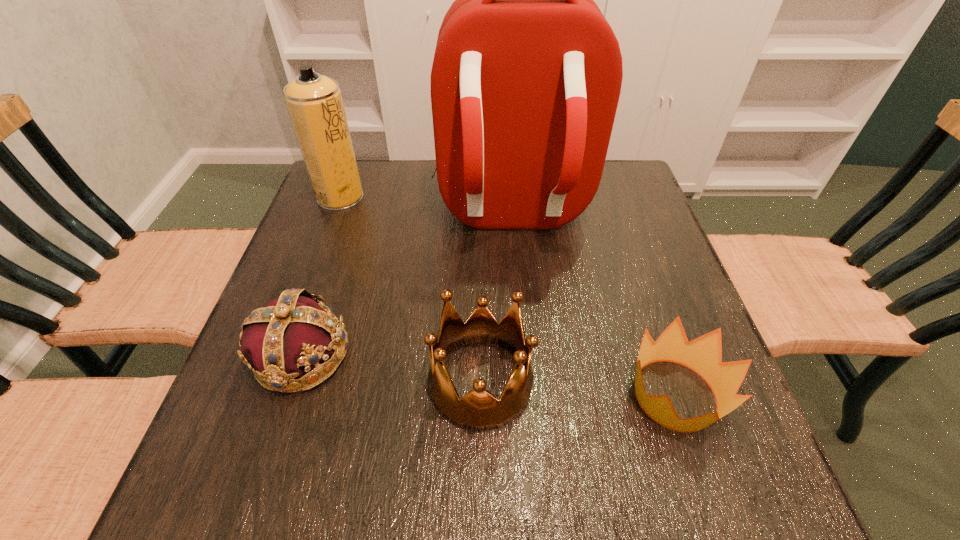
This screenshot has height=540, width=960. In order to click on vacant region located 0.060m on the left of the second crown from right to left in this screenshot , I will do `click(396, 382)`.

Find the location of a particular element. vacant point located 0.070m on the back of the leftmost crown is located at coordinates (324, 289).

Find the location of a particular element. The width and height of the screenshot is (960, 540). vacant space located on the back of the shortest crown is located at coordinates click(x=621, y=236).

Image resolution: width=960 pixels, height=540 pixels. I want to click on backpack positioned at the far edge, so click(x=526, y=78).

Where is `aerosol can located in the far edge section of the desktop`? The image size is (960, 540). aerosol can located in the far edge section of the desktop is located at coordinates (314, 101).

You are a GUI agent. You are given a task and a screenshot of the screen. Output one action in this format:
    pyautogui.click(x=<x>, y=<y>)
    Task: Click on the aerosol can positioned at the left edge
    
    Given the screenshot: What is the action you would take?
    pyautogui.click(x=314, y=101)

Find the location of a particular element. The height and width of the screenshot is (540, 960). crown positioned at the left edge is located at coordinates (290, 335).

Locate an element on the screen. The height and width of the screenshot is (540, 960). object positioned at the right edge is located at coordinates coord(703,355).

In order to click on object at the far left corner in this screenshot , I will do `click(314, 101)`.

Find the location of a particular element. This screenshot has width=960, height=540. vacant space at the left edge of the desktop is located at coordinates (350, 248).